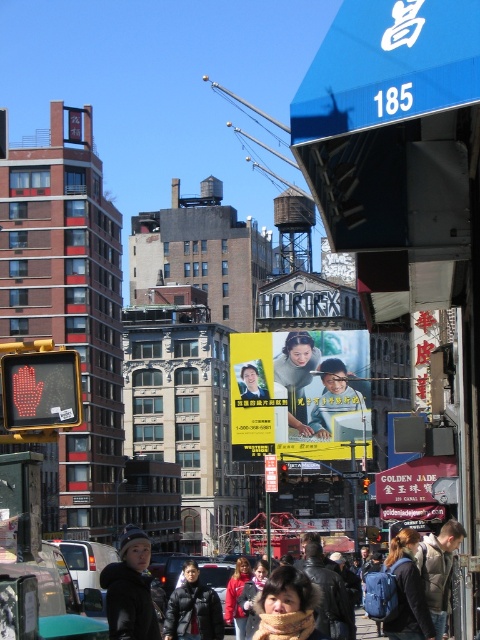
You are a photographer trying to capture a clear shot of both the black matte jacket at lower left and the dark gray jacket at center. However, you notice that one of them is blocking the other. Which jacket is being obscured by the other?

The dark gray jacket at center is being obscured by the black matte jacket at lower left because the black matte jacket at lower left is positioned over it.